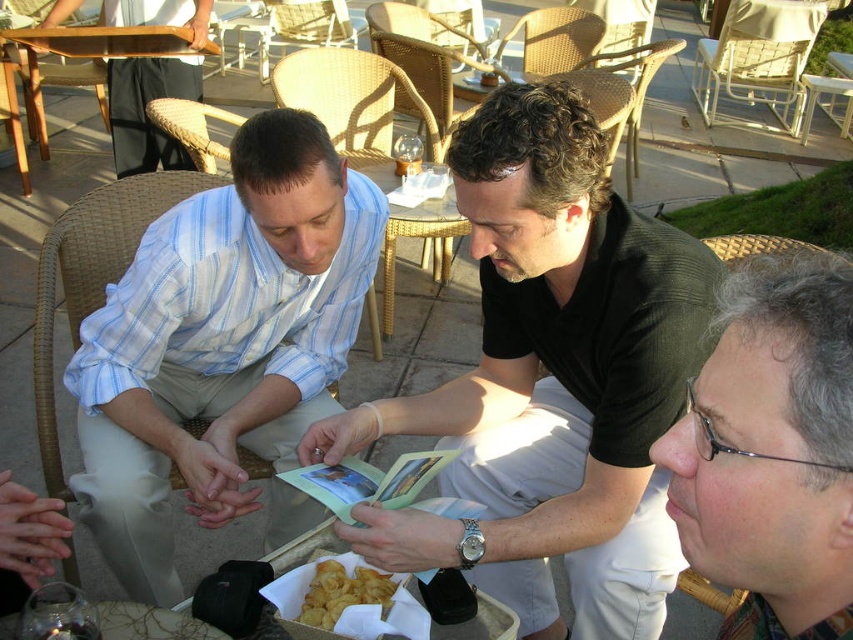
Consider the image. You are organizing a picnic and need to decide which item to place first in your bag. The black matte shirt at center and the white paper tray at lower center are both in your inventory. Based on their sizes, which should you place first to maximize space efficiency?

The black matte shirt at center is bigger than the white paper tray at lower center, so you should place the black matte shirt at center first to maximize space efficiency by placing larger items first.

Where is the woven wicker chair at center located in the image?

The woven wicker chair at center is located at point (357, 104) in the image.